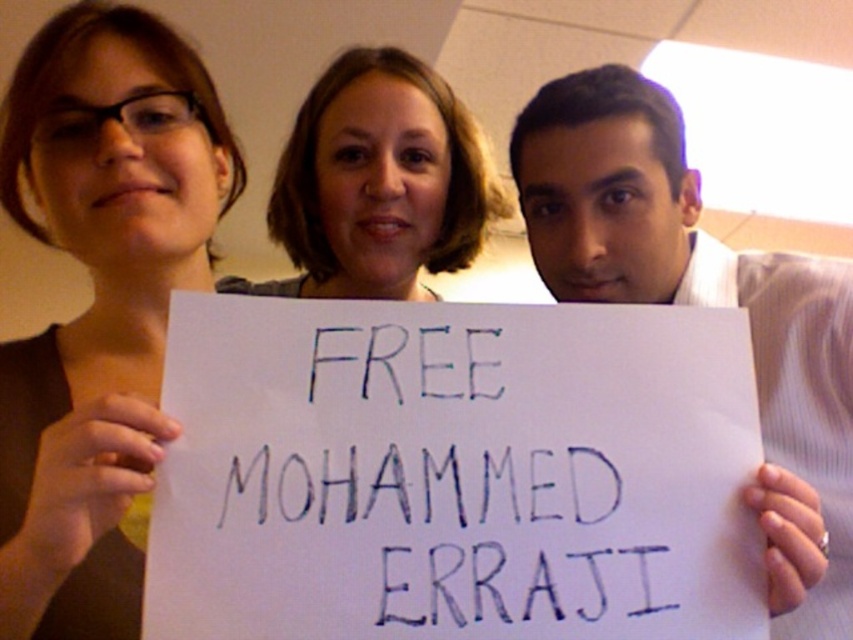
Is matte brown hair at upper left above smooth brown hair at center?

Incorrect, matte brown hair at upper left is not positioned above smooth brown hair at center.

Who is shorter, matte brown hair at upper left or smooth brown hair at center?

smooth brown hair at center is shorter.

Which is in front, point (74, 376) or point (459, 141)?

Point (74, 376) is in front.

At what (x,y) coordinates should I click in order to perform the action: click on matte brown hair at upper left. Please return your answer as a coordinate pair (x, y). Looking at the image, I should click on (99, 301).

Measure the distance between matte brown hair at upper left and white paper sign at center.

They are 16.57 inches apart.

You are a GUI agent. You are given a task and a screenshot of the screen. Output one action in this format:
    pyautogui.click(x=<x>, y=<y>)
    Task: Click on the matte brown hair at upper left
    
    Given the screenshot: What is the action you would take?
    pyautogui.click(x=99, y=301)

Locate an element on the screen. Image resolution: width=853 pixels, height=640 pixels. matte brown hair at upper left is located at coordinates (99, 301).

Can you confirm if white paper sign at center is wider than smooth brown hair at center?

Incorrect, white paper sign at center's width does not surpass smooth brown hair at center's.

Is point (630, 252) positioned before point (456, 198)?

Yes, point (630, 252) is closer to viewer.

Identify the location of white paper sign at center. (695, 285).